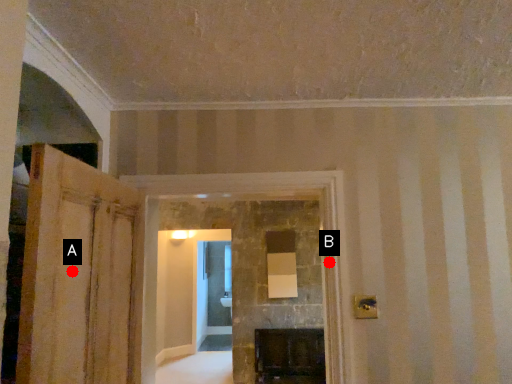
Question: Two points are circled on the image, labeled by A and B beside each circle. Which of the following is the closest to the observer?

Choices:
 (A) A is closer
 (B) B is closer

Answer: (A)